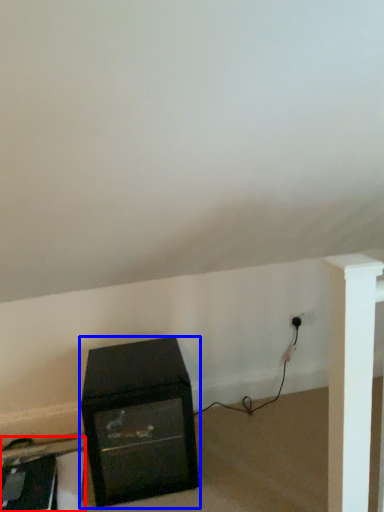
Question: Which point is closer to the camera, furniture (highlighted by a red box) or furniture (highlighted by a blue box)?

Choices:
 (A) furniture
 (B) furniture

Answer: (B)